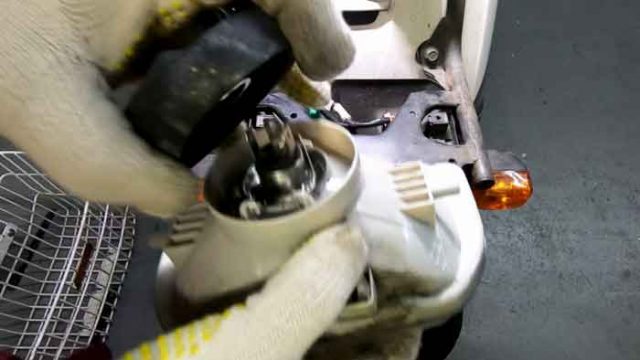
Identify the location of basket. (61, 325).